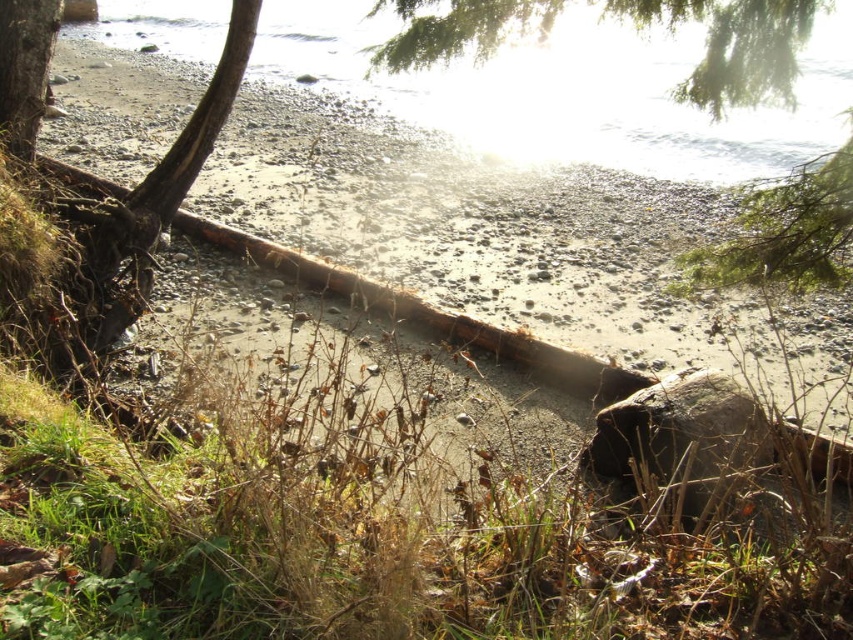
You are a photographer trying to capture the clear water at upper center and the smooth bark tree trunk at left in a single shot. Based on their heights, which object will appear taller in the photo?

The clear water at upper center will appear taller in the photo because it has a greater height compared to the smooth bark tree trunk at left.

Based on the photo, you are standing at the shoreline and see the clear water at upper center and the green leafy tree at upper center. Which one is taller?

The clear water at upper center has a greater height compared to the green leafy tree at upper center, so the clear water at upper center is taller.